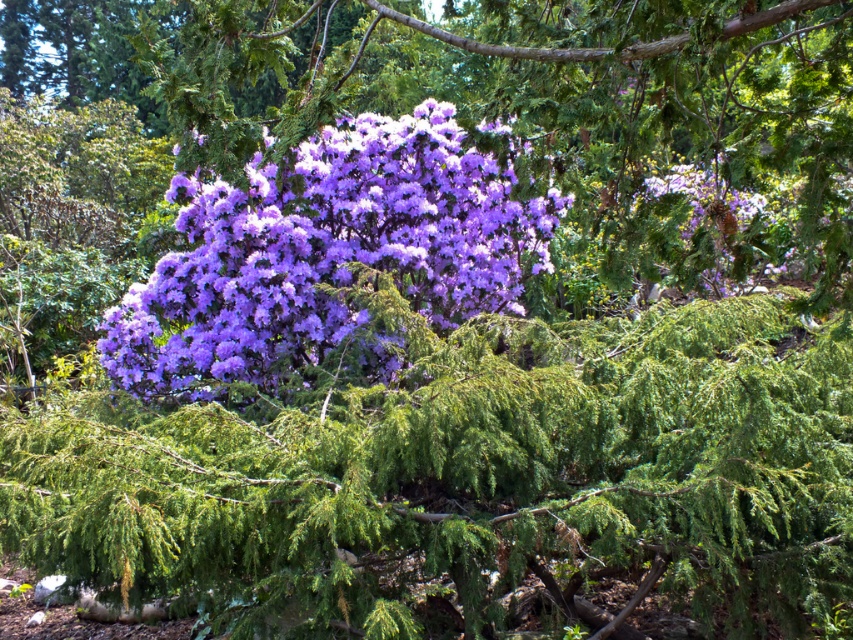
You are a gardener who wants to plant both the purple matte bush at center and the purple matte flower at center in your garden. Which one requires more space to accommodate its size?

The purple matte bush at center is larger in size than the purple matte flower at center, so it requires more space to accommodate its size.

You are a gardener who wants to place a small statue between the purple matte bush at center and the purple matte flower at center. The statue requires at least 1.5 meters of space to be placed safely. Can you place the statue between them?

The purple matte bush at center and purple matte flower at center are 1.48 meters apart from each other, which is less than the required 1.5 meters. Therefore, the statue cannot be placed safely between them.

You are standing in the middle of a natural area and see the purple matte bush at center. If you want to walk directly towards it, which direction should you move relative to your current position?

Since the purple matte bush at center is located at coordinates approximately 0.177 along the horizontal axis and 0.666 along the vertical axis, you should move towards the lower left direction to reach it.